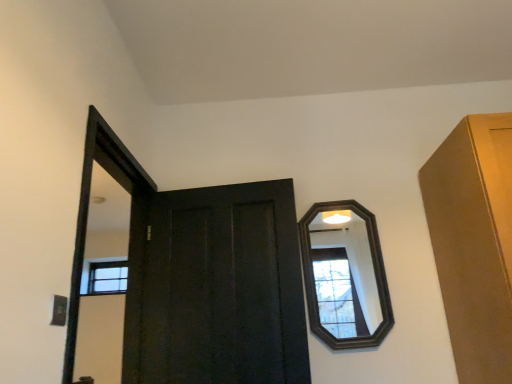
Question: Can you confirm if matte black door at center is shorter than dark wood mirror at upper right?

Choices:
 (A) no
 (B) yes

Answer: (A)

Question: Does matte black door at center appear on the right side of dark wood mirror at upper right?

Choices:
 (A) yes
 (B) no

Answer: (B)

Question: From a real-world perspective, is matte black door at center positioned over dark wood mirror at upper right based on gravity?

Choices:
 (A) yes
 (B) no

Answer: (B)

Question: From a real-world perspective, is matte black door at center located beneath dark wood mirror at upper right?

Choices:
 (A) yes
 (B) no

Answer: (A)

Question: Can you confirm if matte black door at center is bigger than dark wood mirror at upper right?

Choices:
 (A) no
 (B) yes

Answer: (B)

Question: Is matte black door at center positioned before dark wood mirror at upper right?

Choices:
 (A) no
 (B) yes

Answer: (B)

Question: Is dark wood mirror at upper right not close to matte black door at center?

Choices:
 (A) yes
 (B) no

Answer: (B)

Question: From a real-world perspective, is dark wood mirror at upper right physically above matte black door at center?

Choices:
 (A) no
 (B) yes

Answer: (B)

Question: Is dark wood mirror at upper right wider than matte black door at center?

Choices:
 (A) no
 (B) yes

Answer: (A)

Question: Could matte black door at center be considered to be inside dark wood mirror at upper right?

Choices:
 (A) no
 (B) yes

Answer: (A)

Question: Is dark wood mirror at upper right smaller than matte black door at center?

Choices:
 (A) yes
 (B) no

Answer: (A)

Question: Is dark wood mirror at upper right taller than matte black door at center?

Choices:
 (A) no
 (B) yes

Answer: (A)

Question: Based on their positions, is dark wood mirror at upper right located to the left or right of matte black door at center?

Choices:
 (A) left
 (B) right

Answer: (B)